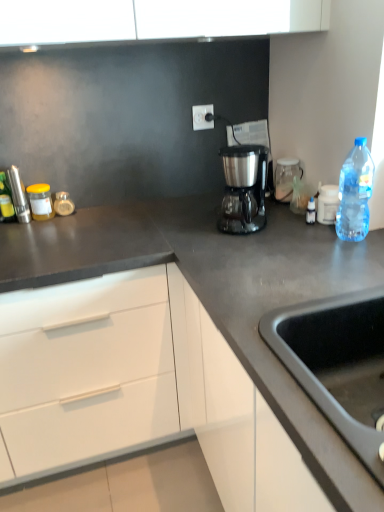
This screenshot has width=384, height=512. I want to click on free space in front of brushed metal pepper mill at left, which ranks as the first appliance in left-to-right order, so click(x=23, y=234).